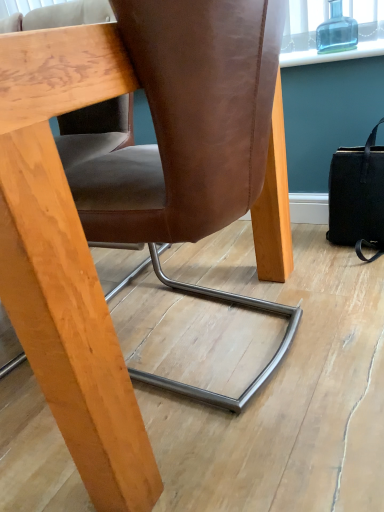
Question: Visually, is transparent glass bottle at upper right positioned to the left or to the right of brown leather chair at center?

Choices:
 (A) right
 (B) left

Answer: (A)

Question: Relative to brown leather chair at center, is transparent glass bottle at upper right in front or behind?

Choices:
 (A) front
 (B) behind

Answer: (B)

Question: Estimate the real-world distances between objects in this image. Which object is closer to the brown leather chair at center?

Choices:
 (A) transparent glass bottle at upper right
 (B) black leather handbag at right

Answer: (B)

Question: Based on their relative distances, which object is farther from the transparent glass bottle at upper right?

Choices:
 (A) brown leather chair at center
 (B) black leather handbag at right

Answer: (A)